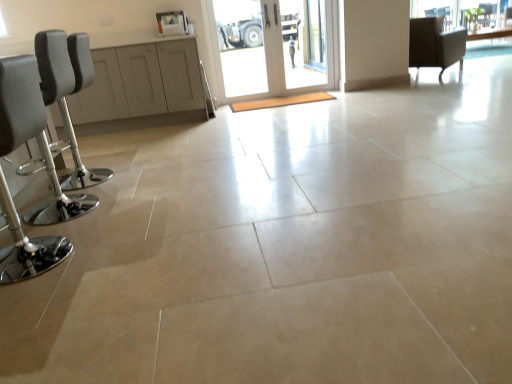
Question: Does clear glass window at upper right have a greater height compared to black leather barstool at left, the third chair positioned from the right?

Choices:
 (A) yes
 (B) no

Answer: (B)

Question: Can you confirm if clear glass window at upper right is positioned to the left of black leather barstool at left, the first chair positioned from the left?

Choices:
 (A) no
 (B) yes

Answer: (A)

Question: Does clear glass window at upper right contain black leather barstool at left, the first chair positioned from the left?

Choices:
 (A) yes
 (B) no

Answer: (B)

Question: Is clear glass window at upper right positioned with its back to black leather barstool at left, the second chair ordered from the bottom?

Choices:
 (A) no
 (B) yes

Answer: (A)

Question: Considering the relative sizes of clear glass window at upper right and black leather barstool at left, the second chair ordered from the bottom, in the image provided, is clear glass window at upper right thinner than black leather barstool at left, the second chair ordered from the bottom,?

Choices:
 (A) yes
 (B) no

Answer: (A)

Question: Is clear glass window screen at upper right spatially inside metallic chrome barstool at left, which is the third chair in top-to-bottom order, or outside of it?

Choices:
 (A) inside
 (B) outside

Answer: (B)

Question: From the image's perspective, is clear glass window screen at upper right positioned above or below metallic chrome barstool at left, placed as the 2th chair when sorted from left to right?

Choices:
 (A) below
 (B) above

Answer: (B)

Question: Based on their sizes in the image, would you say clear glass window screen at upper right is bigger or smaller than metallic chrome barstool at left, placed as the 2th chair when sorted from left to right?

Choices:
 (A) big
 (B) small

Answer: (B)

Question: Is point (467, 21) closer or farther from the camera than point (9, 74)?

Choices:
 (A) closer
 (B) farther

Answer: (B)

Question: Does point (417, 18) appear closer or farther from the camera than point (424, 8)?

Choices:
 (A) closer
 (B) farther

Answer: (A)

Question: From a real-world perspective, is dark gray fabric chair at upper right, which is counted as the 3th chair, starting from the bottom, physically located above or below clear glass window at upper right?

Choices:
 (A) below
 (B) above

Answer: (A)

Question: From their relative heights in the image, would you say dark gray fabric chair at upper right, which is counted as the 3th chair, starting from the bottom, is taller or shorter than clear glass window at upper right?

Choices:
 (A) tall
 (B) short

Answer: (A)

Question: Is dark gray fabric chair at upper right, which is counted as the third chair, starting from the left, situated inside clear glass window at upper right or outside?

Choices:
 (A) inside
 (B) outside

Answer: (B)

Question: Relative to transparent glass door at center, is metallic chrome barstool at left, which is the 3th chair in back-to-front order, in front or behind?

Choices:
 (A) front
 (B) behind

Answer: (A)

Question: Is point (5, 206) positioned closer to the camera than point (309, 69)?

Choices:
 (A) closer
 (B) farther

Answer: (A)